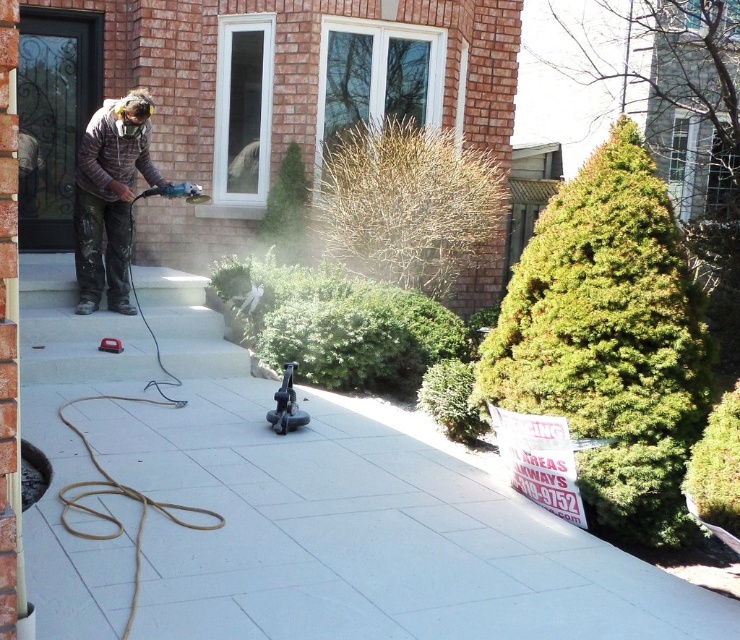
Describe the element at coordinates (352, 516) in the screenshot. I see `white concrete pavement at center` at that location.

Who is positioned more to the right, white concrete pavement at center or camouflage jacket at center?

Positioned to the right is white concrete pavement at center.

The height and width of the screenshot is (640, 740). In order to click on white concrete pavement at center in this screenshot , I will do `click(352, 516)`.